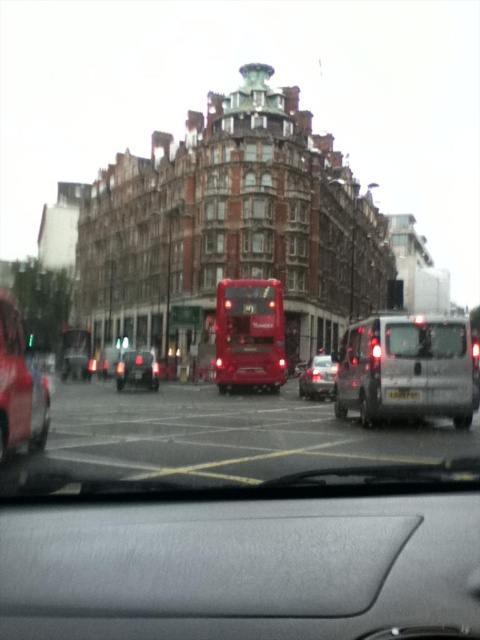
You are driving a car and want to park behind the shiny silver car at center. The parking spot you want is 8 meters long. Do you think you can park there without overlapping the black plastic license plate at center?

The distance between the shiny silver car at center and the black plastic license plate at center is 7.39 meters. Since the parking spot is 8 meters long, you have enough space to park behind the shiny silver car at center without overlapping the black plastic license plate at center.

You are driving a car and notice a metallic red car at left and a transparent glass windshield at center in your view. Which object is closer to you, the driver?

The metallic red car at left is closer to you because it is in front of the transparent glass windshield at center.